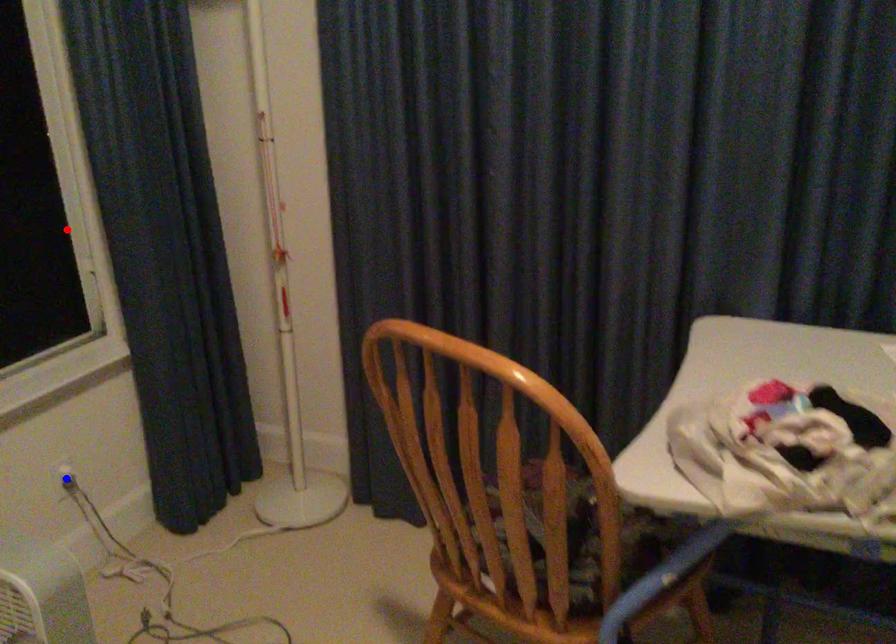
Question: Two points are marked on the image. Which point is closer to the camera?

Choices:
 (A) Blue point is closer.
 (B) Red point is closer.

Answer: (A)